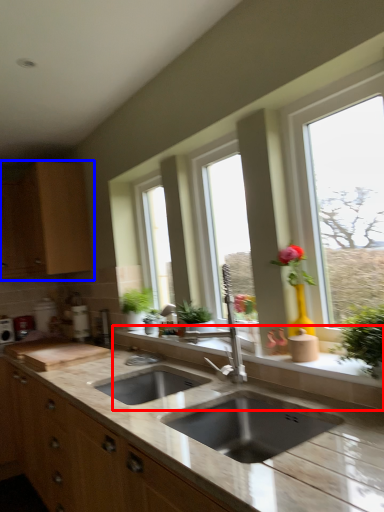
Question: Which object appears farthest to the camera in this image, window sill (highlighted by a red box) or cabinetry (highlighted by a blue box)?

Choices:
 (A) window sill
 (B) cabinetry

Answer: (B)